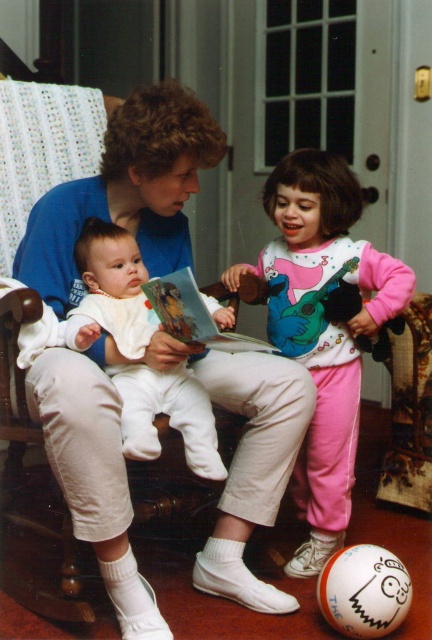
Question: Which point is closer to the camera?

Choices:
 (A) (273, 241)
 (B) (130, 154)
 (C) (148, 339)
 (D) (165, 300)

Answer: (D)

Question: Can you confirm if white soft baby at center is positioned to the left of matte paper book at center?

Choices:
 (A) yes
 (B) no

Answer: (A)

Question: Does matte blue shirt at center appear over matte paper book at center?

Choices:
 (A) yes
 (B) no

Answer: (B)

Question: Is pink fleece onesie at center positioned at the back of matte paper book at center?

Choices:
 (A) yes
 (B) no

Answer: (A)

Question: Which object is farther from the camera taking this photo?

Choices:
 (A) pink fleece onesie at center
 (B) white soft baby at center
 (C) matte paper book at center
 (D) matte blue shirt at center

Answer: (A)

Question: Considering the real-world distances, which object is closest to the matte paper book at center?

Choices:
 (A) matte blue shirt at center
 (B) pink fleece onesie at center
 (C) white soft baby at center

Answer: (C)